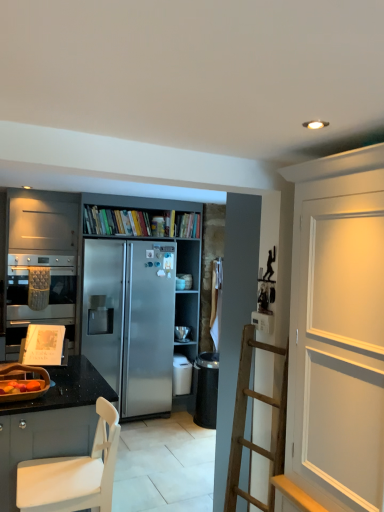
Question: Looking at their shapes, would you say wooden fruit basket at lower left, placed as the first appliance when sorted from front to back, is wider or thinner than black granite countertop at lower left, arranged as the 2th cabinetry when viewed from the back?

Choices:
 (A) wide
 (B) thin

Answer: (B)

Question: Is wooden fruit basket at lower left, which ranks as the 3th appliance in right-to-left order, to the left or to the right of black granite countertop at lower left, arranged as the 2th cabinetry when viewed from the back, in the image?

Choices:
 (A) left
 (B) right

Answer: (B)

Question: Considering the real-world distances, which object is closest to the black granite countertop at lower left, the first cabinetry from the front?

Choices:
 (A) satin silver refrigerator at center, the second cabinetry positioned from the front
 (B) wooden fruit basket at lower left, which ranks as the 3th appliance in right-to-left order
 (C) satin silver refrigerator at center, the third appliance positioned from the front
 (D) satin silver refrigerator at center, the second appliance positioned from the front
 (E) white painted wood door at upper right

Answer: (B)

Question: Which object is positioned farthest from the black granite countertop at lower left, the first cabinetry from the front?

Choices:
 (A) satin silver refrigerator at center, which ranks as the 1th cabinetry in back-to-front order
 (B) white painted wood door at upper right
 (C) matte silver oven at left
 (D) wooden fruit basket at lower left, marked as the 1th appliance in a left-to-right arrangement
 (E) satin silver refrigerator at center, the second appliance positioned from the front

Answer: (E)